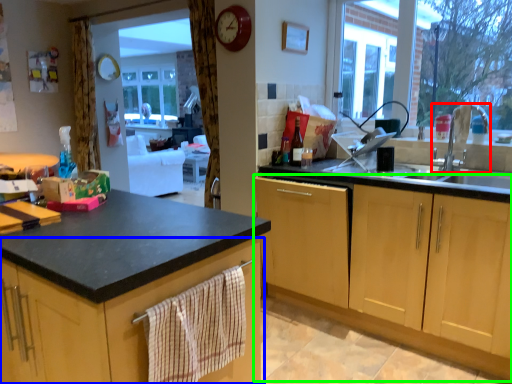
Question: Based on their relative distances, which object is nearer to tap (highlighted by a red box)? Choose from cabinetry (highlighted by a blue box) and cabinetry (highlighted by a green box).

Choices:
 (A) cabinetry
 (B) cabinetry

Answer: (B)